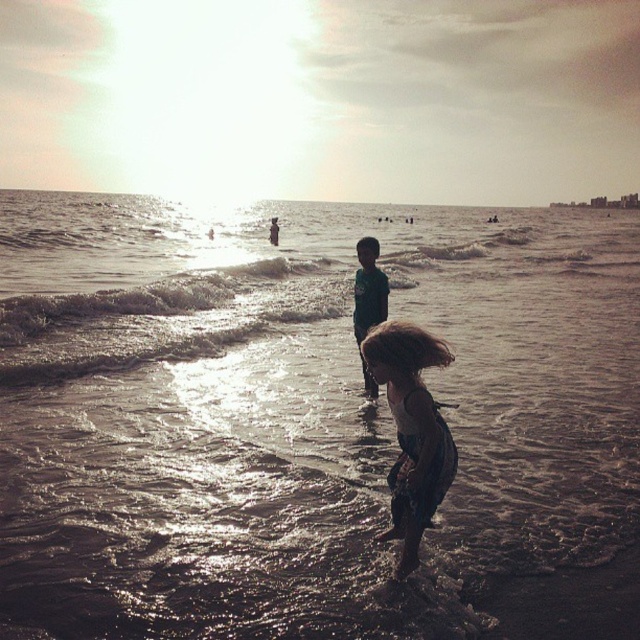
You are a photographer trying to capture the reflection of the sunset on the shiny wet sand at center and the dark hair at lower center. Which object is positioned higher in the frame?

The shiny wet sand at center is above the dark hair at lower center, so it is positioned higher in the frame.

You are standing at point (x=120, y=381) and want to take a photo of the beach scene. The camera you are using has a maximum range of 40 feet. Will you be able to capture the entire scene within the camera range?

The distance between point (x=120, y=381) and the camera is 41.80 feet, which exceeds the camera maximum range of 40 feet. Therefore, you will not be able to capture the entire scene within the camera range.